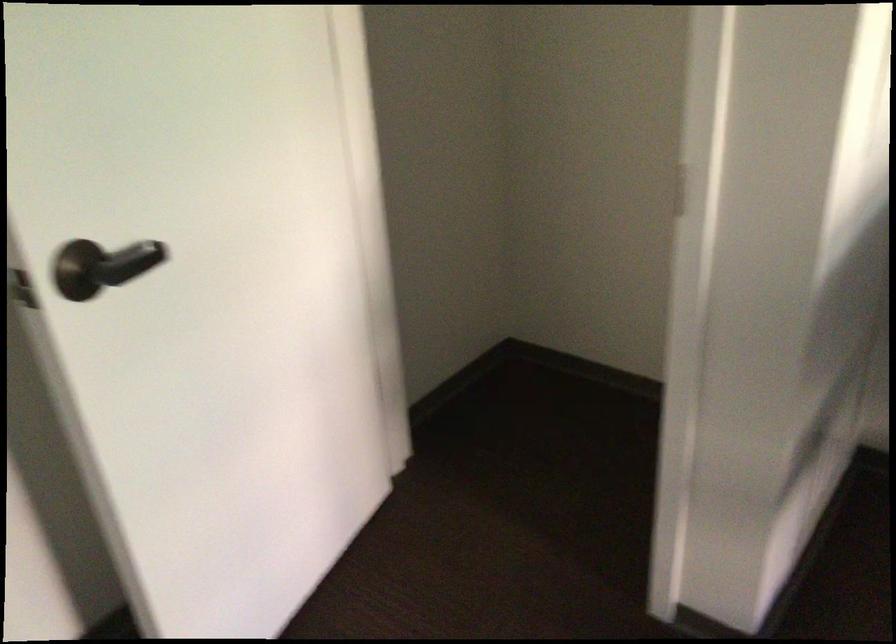
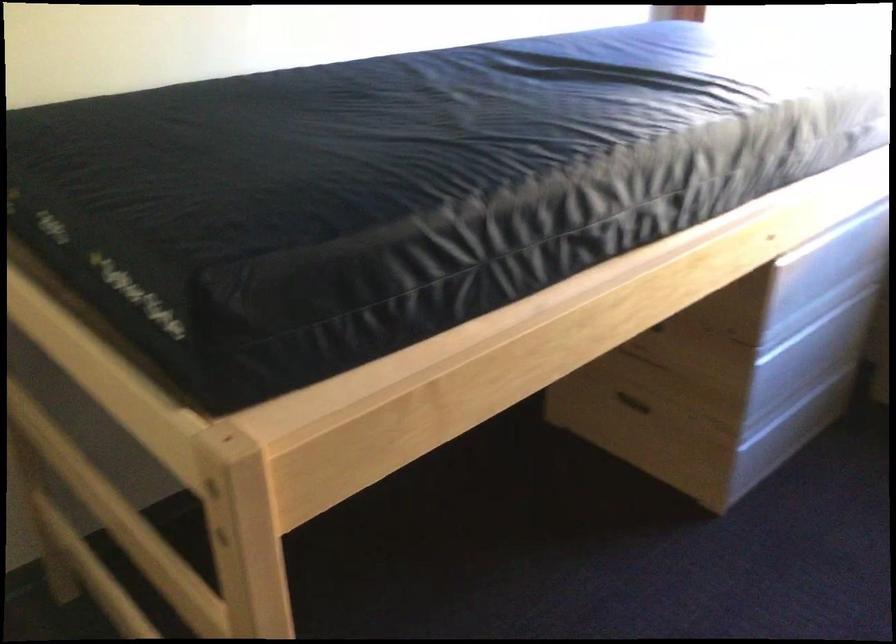
First-person continuous shooting, in which direction is the camera rotating?

The rotation direction of the camera is right-down.